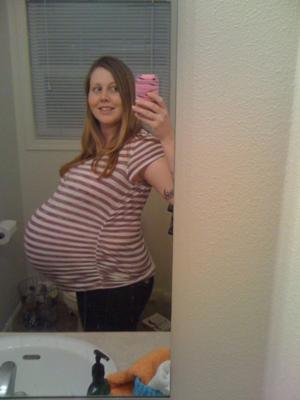
Identify the location of faucet. This screenshot has width=300, height=400. (8, 367).